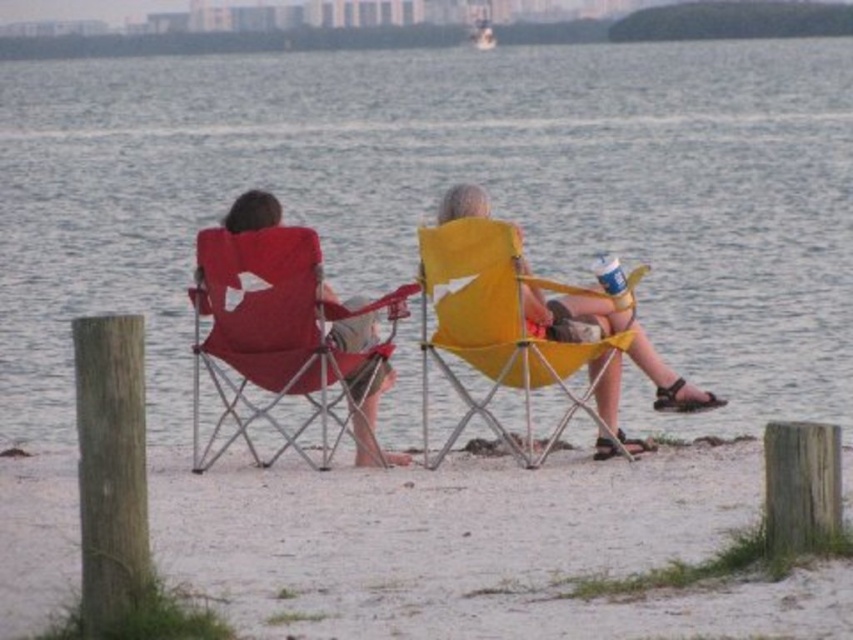
At what (x,y) coordinates should I click in order to perform the action: click on white sand at center. Please return your answer as a coordinate pair (x, y). Looking at the image, I should click on (479, 547).

Describe the element at coordinates (479, 547) in the screenshot. I see `white sand at center` at that location.

Is point (328, 488) farther from camera compared to point (303, 369)?

No, (328, 488) is closer to viewer.

Where is `white sand at center`? This screenshot has width=853, height=640. white sand at center is located at coordinates (479, 547).

Which is more to the left, blue water at center or matte red chair at center?

blue water at center is more to the left.

Is blue water at center above matte red chair at center?

Yes.

You are a GUI agent. You are given a task and a screenshot of the screen. Output one action in this format:
    pyautogui.click(x=<x>, y=<y>)
    Task: Click on the blue water at center
    The width and height of the screenshot is (853, 640).
    Given the screenshot: What is the action you would take?
    pyautogui.click(x=440, y=193)

Where is `blue water at center`? This screenshot has height=640, width=853. blue water at center is located at coordinates (440, 193).

In the scene shown: Is matte red beach chair at left to the left of yellow fabric beach chair at center from the viewer's perspective?

Correct, you'll find matte red beach chair at left to the left of yellow fabric beach chair at center.

You are a GUI agent. You are given a task and a screenshot of the screen. Output one action in this format:
    pyautogui.click(x=<x>, y=<y>)
    Task: Click on the matte red beach chair at left
    The width and height of the screenshot is (853, 640).
    Given the screenshot: What is the action you would take?
    pyautogui.click(x=279, y=333)